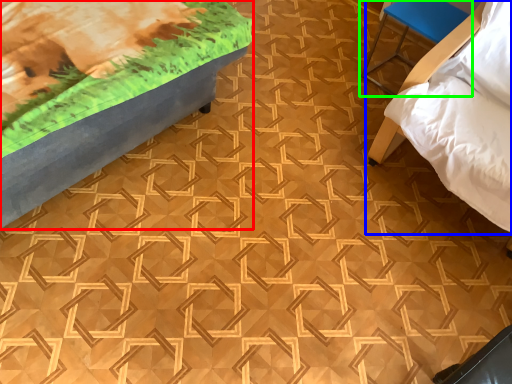
Question: Which is nearer to the furniture (highlighted by a red box)? furniture (highlighted by a blue box) or furniture (highlighted by a green box).

Choices:
 (A) furniture
 (B) furniture

Answer: (A)